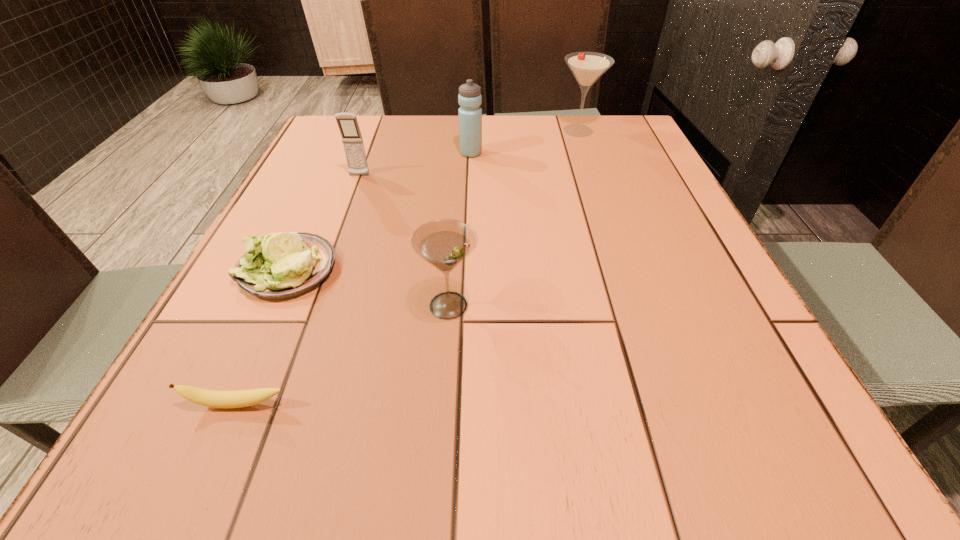
What are the coordinates of `free spot located 0.090m on the left of the water bottle` in the screenshot? It's located at (426, 153).

Where is `free space located on the back of the nearer martini`? free space located on the back of the nearer martini is located at coordinates (452, 259).

Where is `vacant space located 0.370m on the front-facing side of the third farthest object`? The width and height of the screenshot is (960, 540). vacant space located 0.370m on the front-facing side of the third farthest object is located at coordinates (319, 284).

Where is `free space located on the front of the lettuce`? Image resolution: width=960 pixels, height=540 pixels. free space located on the front of the lettuce is located at coordinates (239, 376).

The height and width of the screenshot is (540, 960). Find the location of `martini that is at the far edge`. martini that is at the far edge is located at coordinates (587, 67).

The height and width of the screenshot is (540, 960). Find the location of `water bottle situated at the far edge`. water bottle situated at the far edge is located at coordinates (469, 98).

Locate an element on the screen. The width and height of the screenshot is (960, 540). cellular telephone at the left edge is located at coordinates (348, 125).

At what (x,y) coordinates should I click in order to perform the action: click on lettuce located in the left edge section of the desktop. Please return your answer as a coordinate pair (x, y). The image size is (960, 540). Looking at the image, I should click on (283, 265).

Identify the location of banana situated at the left edge. (211, 398).

The image size is (960, 540). I want to click on object present at the right edge, so click(x=587, y=67).